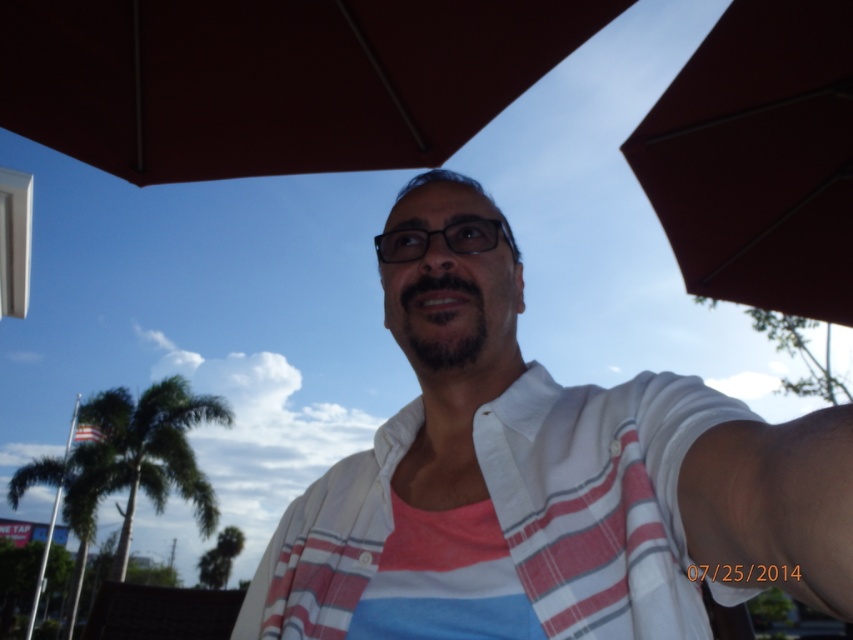
Question: Which point appears closest to the camera in this image?

Choices:
 (A) (4, 17)
 (B) (213, 497)

Answer: (A)

Question: Does green leafy palm tree at lower left have a smaller size compared to black plastic glasses at center?

Choices:
 (A) no
 (B) yes

Answer: (A)

Question: Which point appears closest to the camera in this image?

Choices:
 (A) (659, 132)
 (B) (165, 460)
 (C) (843, 616)
 (D) (389, 230)

Answer: (C)

Question: Can you confirm if white striped shirt at center is thinner than matte red umbrella at upper right?

Choices:
 (A) yes
 (B) no

Answer: (A)

Question: Which is nearer to the brown matte umbrella at upper center?

Choices:
 (A) black plastic glasses at center
 (B) green leafy palm tree at lower left

Answer: (A)

Question: Considering the relative positions of white striped shirt at center and brown matte umbrella at upper center in the image provided, where is white striped shirt at center located with respect to brown matte umbrella at upper center?

Choices:
 (A) right
 (B) left

Answer: (A)